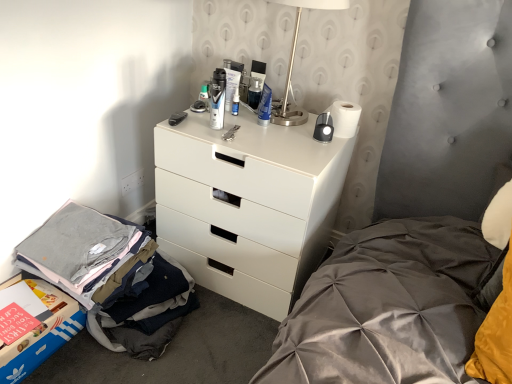
This screenshot has width=512, height=384. I want to click on vacant area that lies between white matte toilet paper at upper right and blue glossy bottle at center, the fourth toiletry positioned from the left, so click(284, 124).